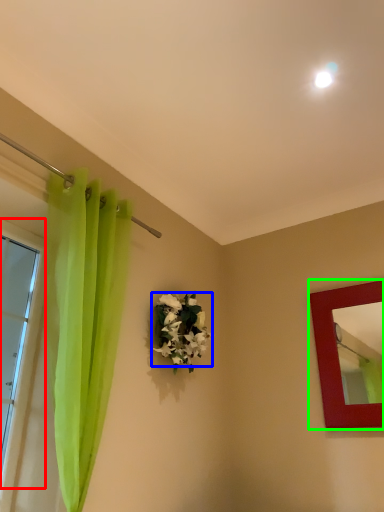
Question: Considering the real-world distances, which object is closest to window (highlighted by a red box)? flower (highlighted by a blue box) or picture frame (highlighted by a green box).

Choices:
 (A) flower
 (B) picture frame

Answer: (A)